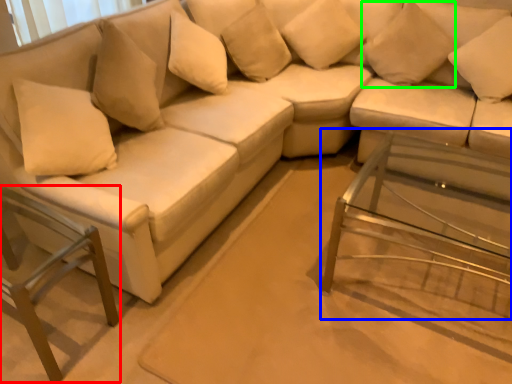
Question: Considering the real-world distances, which object is closest to swivel chair (highlighted by a red box)? side table (highlighted by a blue box) or pillow (highlighted by a green box).

Choices:
 (A) side table
 (B) pillow

Answer: (A)